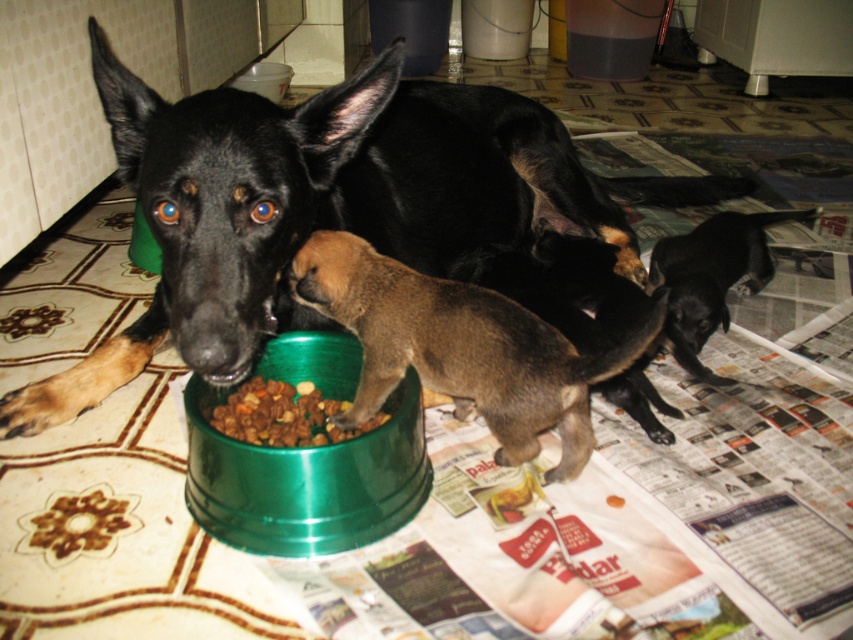
You are a photographer standing at the origin point of the coordinate system. You want to take a photo of the black glossy dog at center. Where should you position your camera to capture it perfectly?

The black glossy dog at center is located at the 2D coordinate point of (326, 204). To capture it perfectly, position your camera at that coordinate point.

You are a dog trainer observing the scene. You notice the black glossy dog at center and the black smooth coat at lower right. Which object is closer to the camera?

The black glossy dog at center is closer to the camera than the black smooth coat at lower right because it is positioned over it.